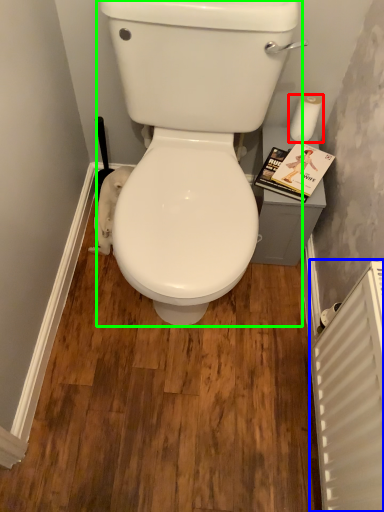
Question: Which object is the closest to the toilet paper (highlighted by a red box)? Choose among these: radiator (highlighted by a blue box) or porcelain (highlighted by a green box).

Choices:
 (A) radiator
 (B) porcelain

Answer: (B)